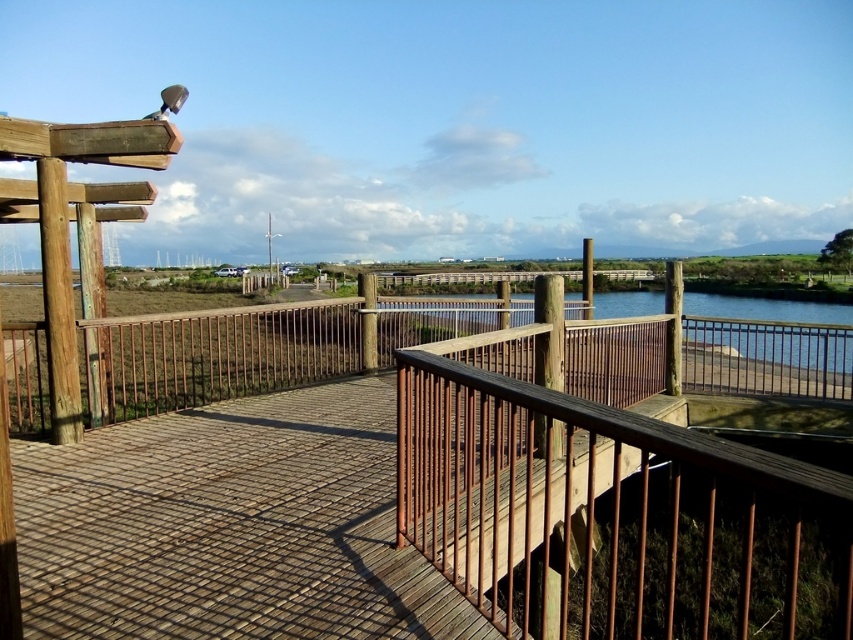
Describe the element at coordinates (607, 502) in the screenshot. I see `rustic wood railing at center` at that location.

What are the coordinates of `rustic wood railing at center` in the screenshot? It's located at (607, 502).

Between point (682, 456) and point (733, 307), which one is positioned behind?

The point (733, 307) is behind.

Find the location of a particular element. This screenshot has height=640, width=853. rustic wood railing at center is located at coordinates (607, 502).